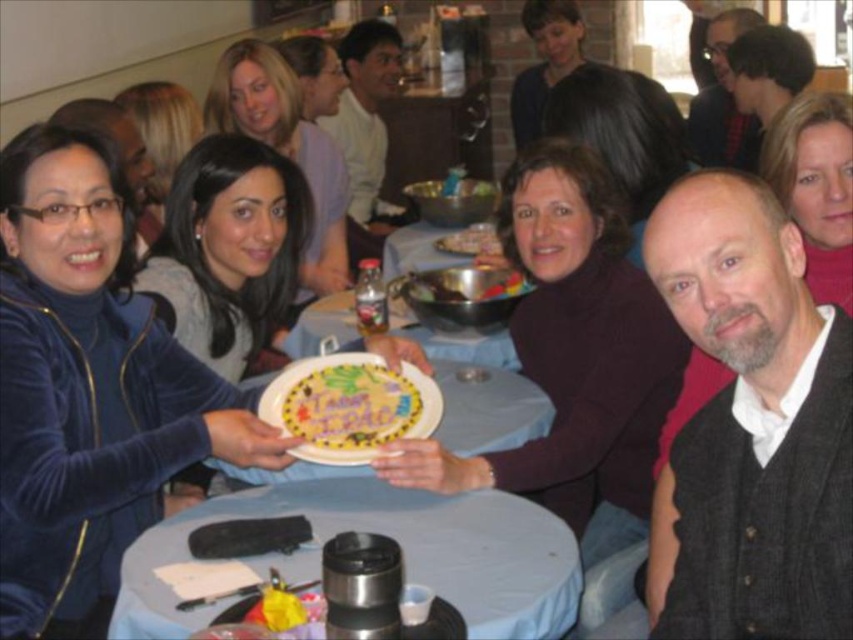
Question: Which object is farther from the camera taking this photo?

Choices:
 (A) smooth plastic table at center
 (B) smooth chocolate cake at center
 (C) shiny metallic bowl at center

Answer: (B)

Question: Which object appears closest to the camera in this image?

Choices:
 (A) shiny metallic bowl at center
 (B) decorative paper plate at center

Answer: (B)

Question: Can you confirm if decorative paper plate at center is thinner than shiny metallic bowl at center?

Choices:
 (A) no
 (B) yes

Answer: (B)

Question: Where is decorative paper plate at center located in relation to shiny metallic bowl at center in the image?

Choices:
 (A) above
 (B) below

Answer: (B)

Question: Which of the following is the closest to the observer?

Choices:
 (A) (506, 289)
 (B) (393, 385)
 (C) (170, 563)

Answer: (C)

Question: Does shiny metallic bowl at center appear on the left side of smooth chocolate cake at center?

Choices:
 (A) yes
 (B) no

Answer: (A)